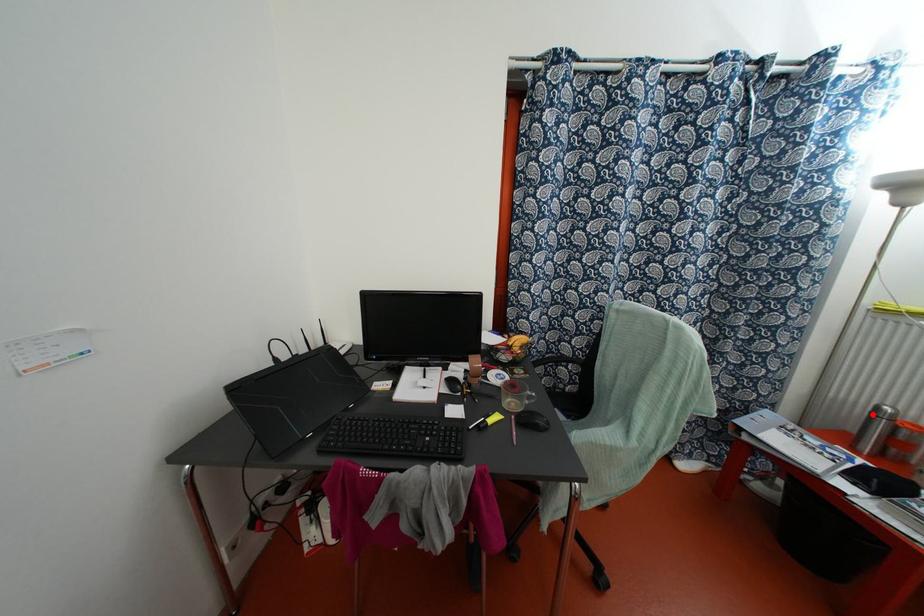
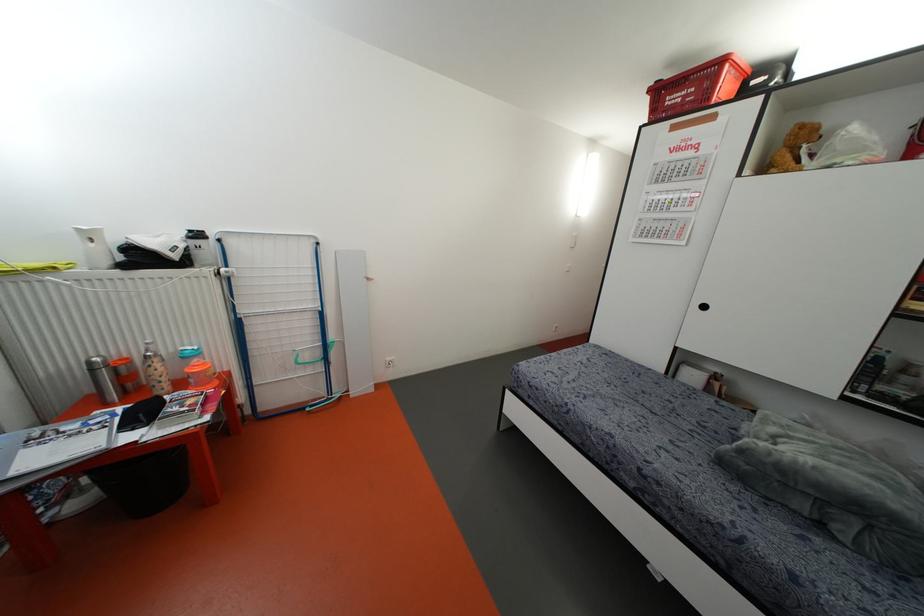
Question: I am providing you with two images of the same scene from different viewpoints. A red point is marked on the first image. Can you still see the location of the red point in image 2?

Choices:
 (A) Yes
 (B) No

Answer: (A)